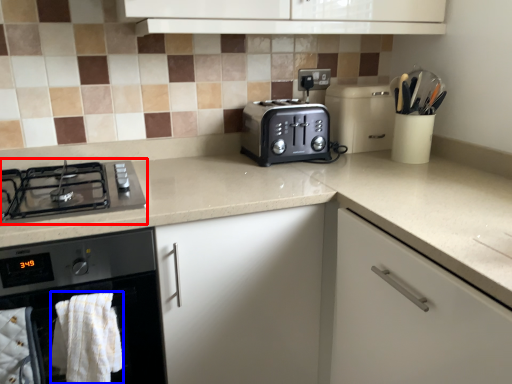
Question: Which object appears farthest to the camera in this image, gas stove (highlighted by a red box) or bath towel (highlighted by a blue box)?

Choices:
 (A) gas stove
 (B) bath towel

Answer: (A)